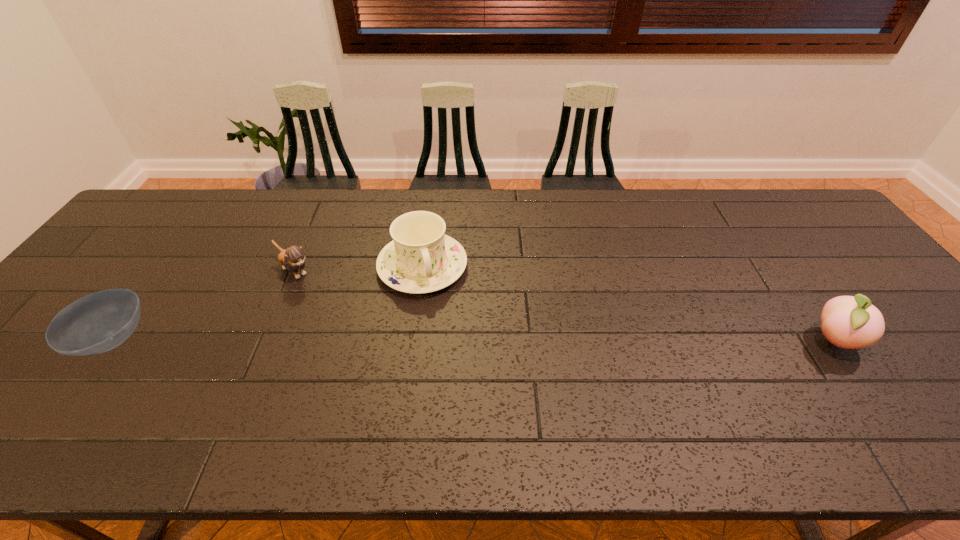
Find the location of a particular element. free space located 0.120m on the front-facing side of the kitten is located at coordinates (334, 303).

This screenshot has height=540, width=960. In order to click on free region located 0.260m on the handle side of the third object from left to right in this screenshot , I will do `click(460, 380)`.

I want to click on vacant space situated 0.130m on the handle side of the third object from left to right, so click(445, 336).

Find the location of a particular element. vacant space situated on the handle side of the third object from left to right is located at coordinates (452, 359).

Locate an element on the screen. Image resolution: width=960 pixels, height=540 pixels. object located in the near edge section of the desktop is located at coordinates (99, 322).

Identify the location of object situated at the left edge. (99, 322).

Locate an element on the screen. object that is positioned at the near left corner is located at coordinates (99, 322).

The height and width of the screenshot is (540, 960). Find the location of `vacant area at the far edge of the desktop`. vacant area at the far edge of the desktop is located at coordinates (571, 194).

At what (x,y) coordinates should I click in order to perform the action: click on vacant space at the near edge of the desktop. Please return your answer as a coordinate pair (x, y). The image size is (960, 540). Looking at the image, I should click on (905, 397).

The image size is (960, 540). Identify the location of vacant space at the left edge of the desktop. (91, 285).